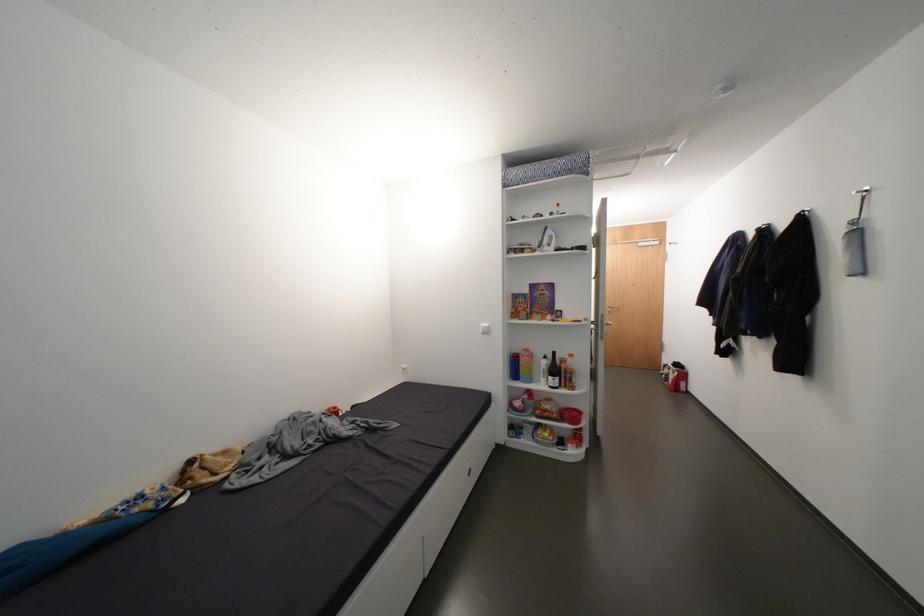
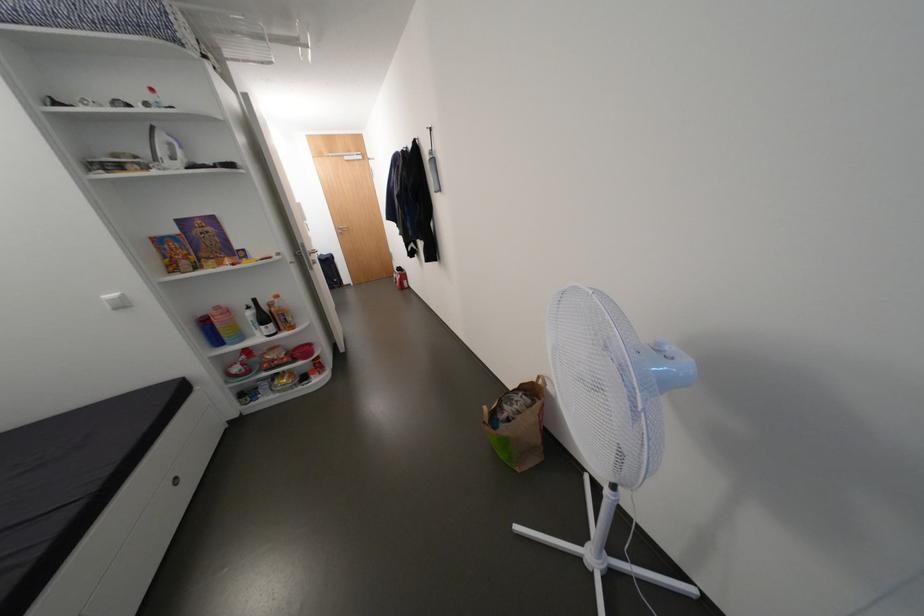
Locate, in the second image, the point that corresponds to (578,416) in the first image.

(310, 352)